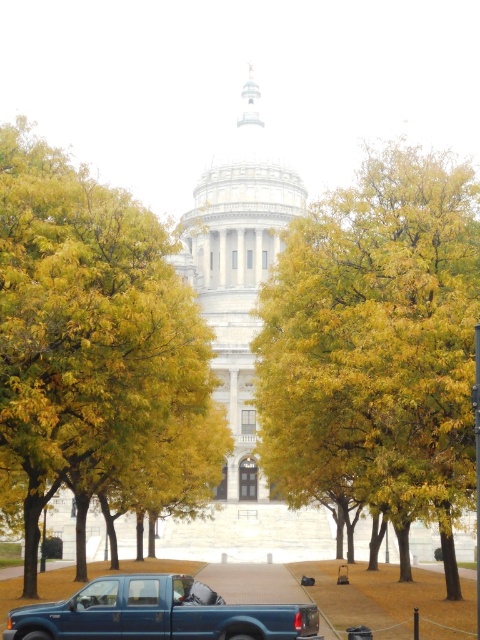
Question: Observing the image, what is the correct spatial positioning of yellow leafy tree at center in reference to metallic blue truck at lower left?

Choices:
 (A) left
 (B) right

Answer: (B)

Question: Estimate the real-world distances between objects in this image. Which object is closer to the yellow leafy tree at center?

Choices:
 (A) metallic blue truck at lower left
 (B) yellow/golden leaves at center

Answer: (B)

Question: Is yellow/golden leaves at center to the left of metallic blue truck at lower left from the viewer's perspective?

Choices:
 (A) yes
 (B) no

Answer: (A)

Question: Which object is the closest to the yellow leafy tree at center?

Choices:
 (A) metallic blue truck at lower left
 (B) yellow/golden leaves at center

Answer: (B)

Question: Is yellow/golden leaves at center wider than metallic blue truck at lower left?

Choices:
 (A) yes
 (B) no

Answer: (B)

Question: Based on their relative distances, which object is nearer to the yellow leafy tree at center?

Choices:
 (A) yellow/golden leaves at center
 (B) metallic blue truck at lower left

Answer: (A)